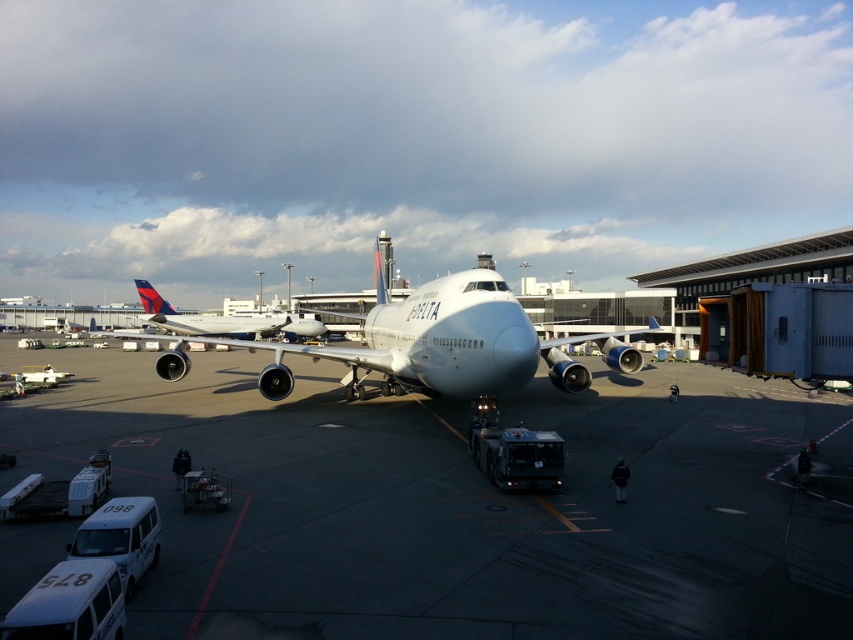
Question: Which point is farther to the camera?

Choices:
 (A) matte white airplane at center
 (B) white smooth tarmac at center
 (C) white glossy airplane at center

Answer: (A)

Question: Which object appears closest to the camera in this image?

Choices:
 (A) white glossy airplane at center
 (B) matte white airplane at center
 (C) white smooth tarmac at center

Answer: (C)

Question: Considering the real-world distances, which object is farthest from the matte white airplane at center?

Choices:
 (A) white smooth tarmac at center
 (B) white glossy airplane at center

Answer: (A)

Question: Can you confirm if white glossy airplane at center is wider than matte white airplane at center?

Choices:
 (A) no
 (B) yes

Answer: (B)

Question: Can you confirm if white smooth tarmac at center is positioned below matte white airplane at center?

Choices:
 (A) yes
 (B) no

Answer: (A)

Question: Is white smooth tarmac at center thinner than matte white airplane at center?

Choices:
 (A) yes
 (B) no

Answer: (B)